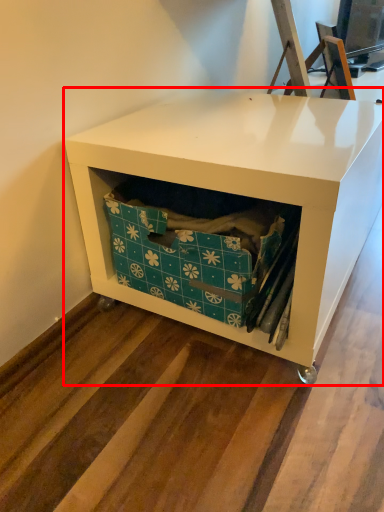
Question: Where is furniture (annotated by the red box) located in relation to storage box in the image?

Choices:
 (A) right
 (B) left

Answer: (A)